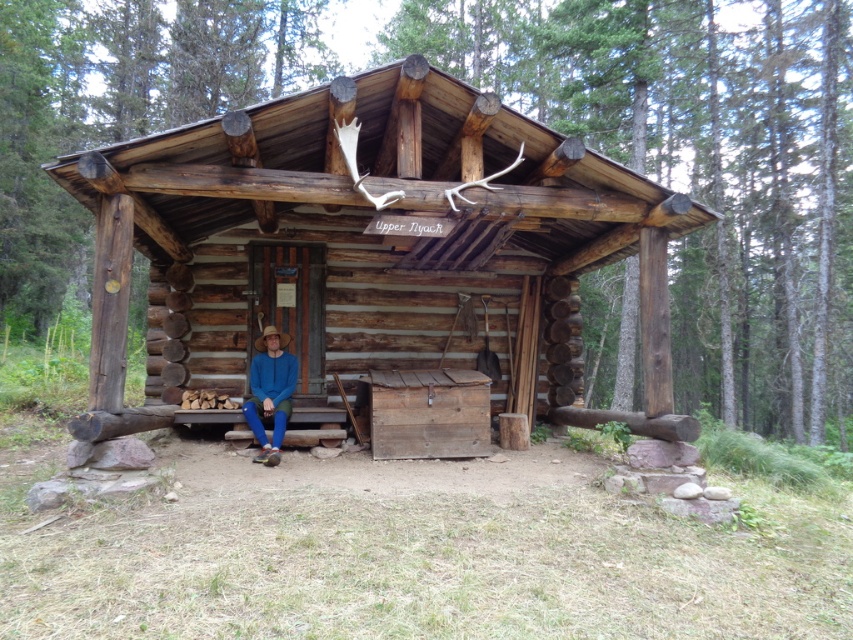
Question: Is rustic wooden cabin at center thinner than blue cotton shirt at center?

Choices:
 (A) no
 (B) yes

Answer: (A)

Question: Which of the following is the closest to the observer?

Choices:
 (A) rustic wooden cabin at center
 (B) blue cotton shirt at center

Answer: (A)

Question: Can you confirm if rustic wooden cabin at center is positioned above blue cotton shirt at center?

Choices:
 (A) no
 (B) yes

Answer: (B)

Question: Is rustic wooden cabin at center behind blue cotton shirt at center?

Choices:
 (A) yes
 (B) no

Answer: (B)

Question: Which of the following is the closest to the observer?

Choices:
 (A) (439, 284)
 (B) (276, 369)

Answer: (B)